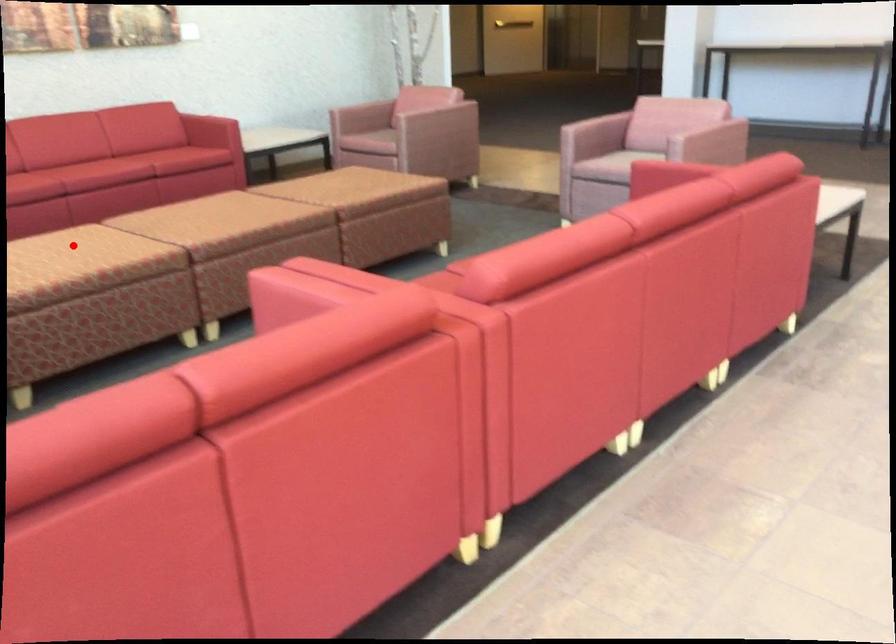
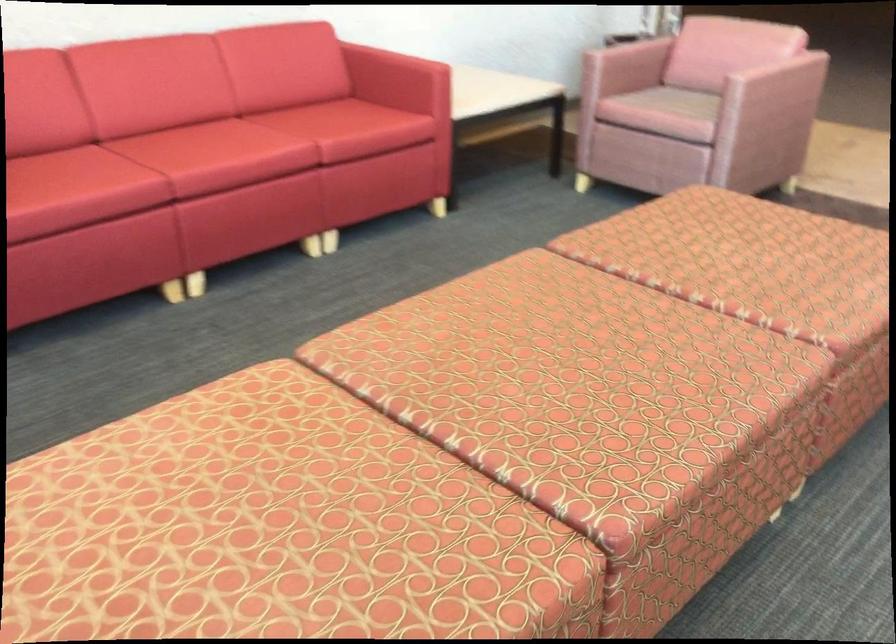
The point at the highlighted location is marked in the first image. Where is the corresponding point in the second image?

(250, 522)